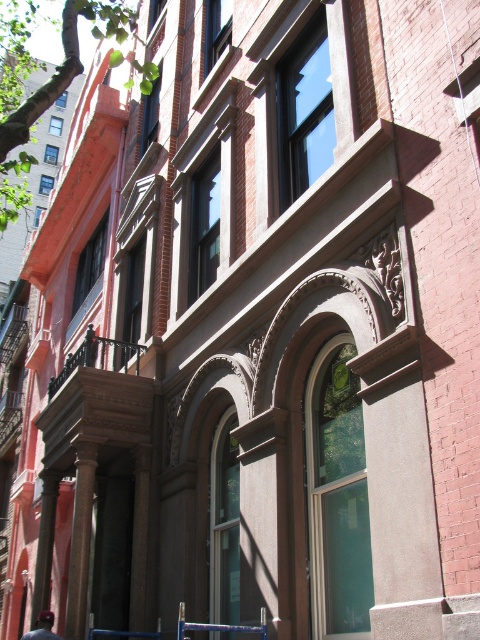
Can you confirm if brown wooden railing at upper left is bigger than dark blue baseball cap at lower left?

No.

Is brown wooden railing at upper left positioned before dark blue baseball cap at lower left?

No, it is behind dark blue baseball cap at lower left.

Describe the element at coordinates (98, 356) in the screenshot. This screenshot has height=640, width=480. I see `brown wooden railing at upper left` at that location.

Find the location of `brown wooden railing at upper left`. brown wooden railing at upper left is located at coordinates (98, 356).